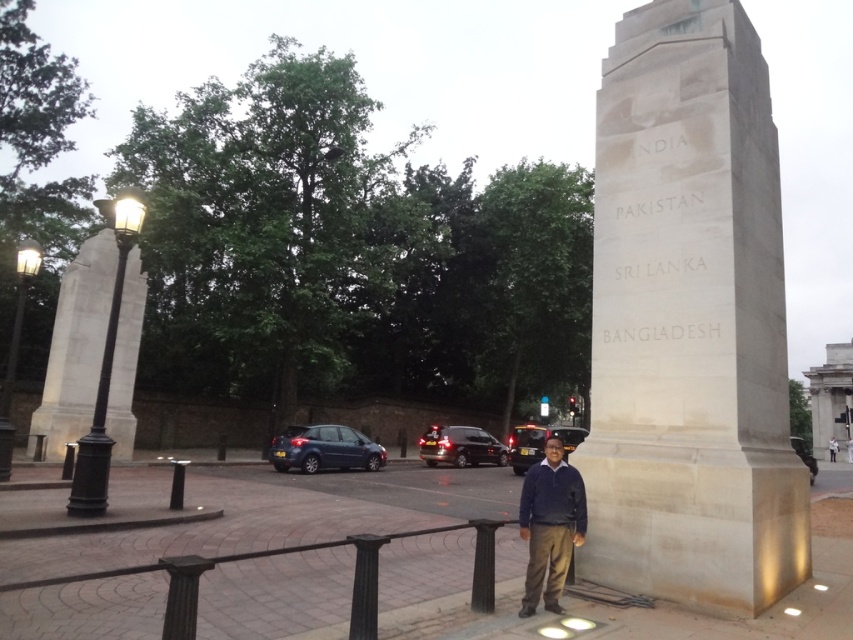
Does point (97, 364) come farther from viewer compared to point (834, 440)?

No, it is not.

Who is higher up, smooth stone column at left or light brown leather jacket at center?

Positioned higher is smooth stone column at left.

Is point (97, 353) closer to viewer compared to point (833, 460)?

Yes.

The image size is (853, 640). Find the location of `smooth stone column at left`. smooth stone column at left is located at coordinates (74, 348).

Between point (544, 566) and point (831, 456), which one is positioned in front?

Point (544, 566)

Can you confirm if dark blue sweater at center is positioned to the left of light brown leather jacket at center?

Correct, you'll find dark blue sweater at center to the left of light brown leather jacket at center.

This screenshot has width=853, height=640. What do you see at coordinates (550, 525) in the screenshot? I see `dark blue sweater at center` at bounding box center [550, 525].

Find the location of a particular element. Image resolution: width=853 pixels, height=640 pixels. dark blue sweater at center is located at coordinates (550, 525).

Who is more forward, (756, 480) or (831, 448)?

Point (756, 480) is in front.

Who is positioned more to the left, white stone monument at right or light brown leather jacket at center?

From the viewer's perspective, white stone monument at right appears more on the left side.

The height and width of the screenshot is (640, 853). In order to click on white stone monument at right in this screenshot , I will do `click(689, 321)`.